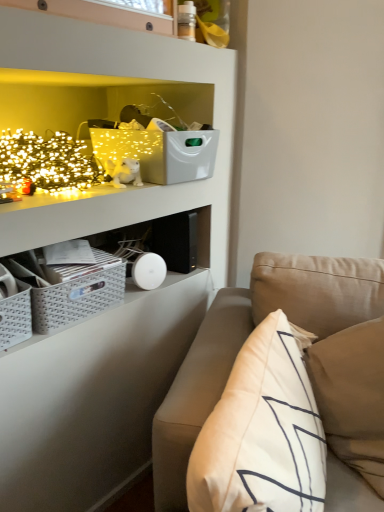
Question: Should I look upward or downward to see white plush cat at upper left?

Choices:
 (A) down
 (B) up

Answer: (B)

Question: Can you confirm if white plush cat at upper left is positioned to the left of beige fabric couch at lower right?

Choices:
 (A) yes
 (B) no

Answer: (A)

Question: Considering the relative sizes of white plush cat at upper left and beige fabric couch at lower right in the image provided, is white plush cat at upper left wider than beige fabric couch at lower right?

Choices:
 (A) yes
 (B) no

Answer: (B)

Question: Is white plush cat at upper left smaller than beige fabric couch at lower right?

Choices:
 (A) yes
 (B) no

Answer: (A)

Question: Is white plush cat at upper left taller than beige fabric couch at lower right?

Choices:
 (A) no
 (B) yes

Answer: (A)

Question: Is white plush cat at upper left beside beige fabric couch at lower right?

Choices:
 (A) yes
 (B) no

Answer: (B)

Question: Considering the relative sizes of white plush cat at upper left and beige fabric couch at lower right in the image provided, is white plush cat at upper left thinner than beige fabric couch at lower right?

Choices:
 (A) no
 (B) yes

Answer: (B)

Question: Is beige fabric couch at lower right bigger than gray woven crate at lower left?

Choices:
 (A) yes
 (B) no

Answer: (A)

Question: Considering the relative positions of beige fabric couch at lower right and gray woven crate at lower left in the image provided, is beige fabric couch at lower right to the left of gray woven crate at lower left from the viewer's perspective?

Choices:
 (A) no
 (B) yes

Answer: (A)

Question: Is beige fabric couch at lower right not inside gray woven crate at lower left?

Choices:
 (A) yes
 (B) no

Answer: (A)

Question: Could you tell me if beige fabric couch at lower right is facing gray woven crate at lower left?

Choices:
 (A) no
 (B) yes

Answer: (A)

Question: From a real-world perspective, is beige fabric couch at lower right on gray woven crate at lower left?

Choices:
 (A) no
 (B) yes

Answer: (A)

Question: Is beige fabric couch at lower right wider than gray woven crate at lower left?

Choices:
 (A) yes
 (B) no

Answer: (A)

Question: Does white soft pillow at right lie behind gray woven crate at lower left?

Choices:
 (A) no
 (B) yes

Answer: (A)